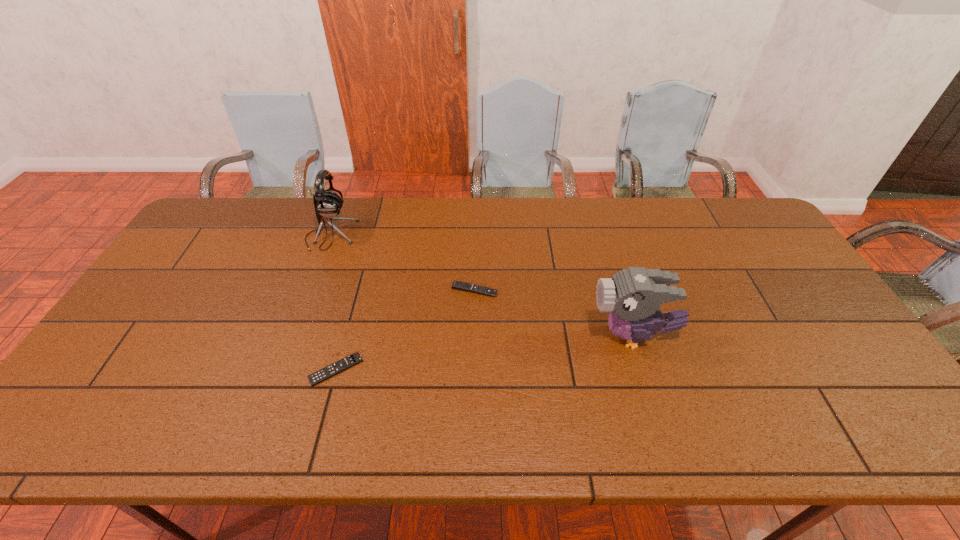
Identify the location of vacant space located 0.380m at the beak of the rightmost object. This screenshot has width=960, height=540. (445, 336).

The height and width of the screenshot is (540, 960). In order to click on vacant space situated on the back of the third tallest object in this screenshot , I will do `click(475, 245)`.

At what (x,y) coordinates should I click in order to perform the action: click on vacant region located on the right of the nearest object. Please return your answer as a coordinate pair (x, y). This screenshot has height=540, width=960. Looking at the image, I should click on (430, 369).

Locate an element on the screen. object present at the far edge is located at coordinates (328, 204).

Identify the location of free space at the far edge of the desktop. (487, 204).

I want to click on blank space at the near edge of the desktop, so click(299, 434).

Locate an element on the screen. The image size is (960, 540). vacant space at the left edge is located at coordinates (131, 382).

Find the location of `vacant space at the right edge of the desktop`. vacant space at the right edge of the desktop is located at coordinates (838, 343).

Image resolution: width=960 pixels, height=540 pixels. In order to click on free space at the far left corner of the desktop in this screenshot , I will do `click(240, 231)`.

At what (x,y) coordinates should I click in order to perform the action: click on vacant space that is in between the nearer remote control and the earphone. Please return your answer as a coordinate pair (x, y). The image size is (960, 540). Looking at the image, I should click on (333, 302).